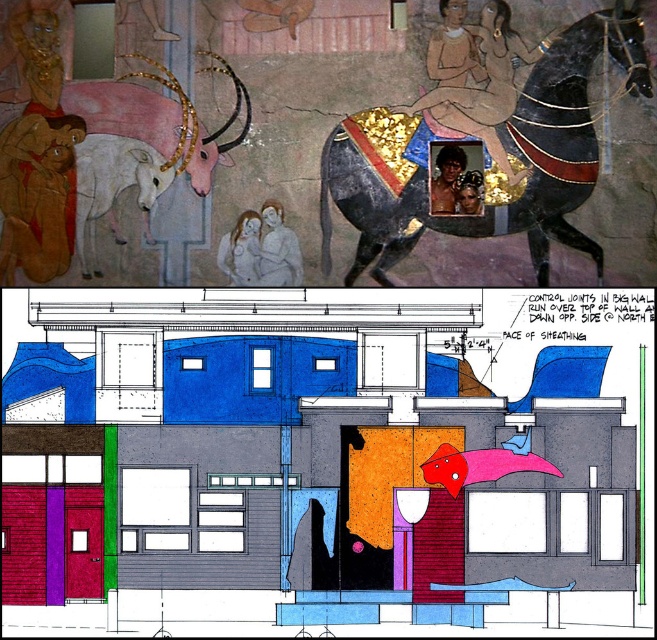
You are an art conservator examining the mural section of the image. You need to clean the shiny black horse at upper right and the shiny gold necklace at upper center. Which object should you clean first if you want to work from the top down?

The shiny black horse at upper right should be cleaned first because it is positioned over the shiny gold necklace at upper center, making it higher in the mural.

You are standing in front of the mural and want to take a photo of the smooth gray figure at center. If your camera has a maximum focus range of 8 meters, will it be able to capture the figure clearly?

The smooth gray figure at center is 8.76 meters away from the camera. Since the camera can only focus up to 8 meters, it won cannot capture the figure clearly.